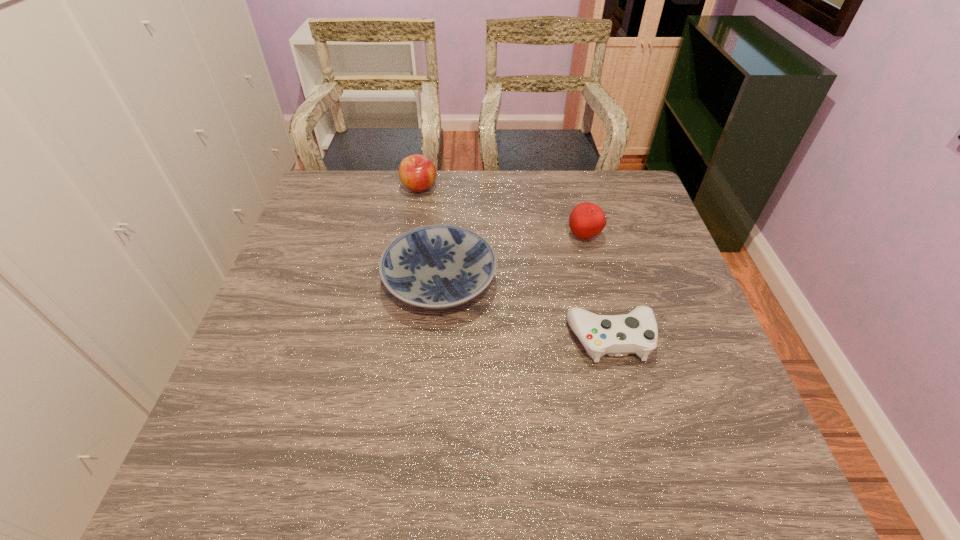
This screenshot has width=960, height=540. Identify the location of object present at the right edge. (636, 332).

In the image, there is a desktop. Identify the location of vacant space at the far edge. (387, 214).

This screenshot has height=540, width=960. In order to click on free region at the near edge in this screenshot , I will do `click(594, 471)`.

Locate an element on the screen. free spot at the left edge of the desktop is located at coordinates (350, 222).

Locate an element on the screen. The width and height of the screenshot is (960, 540). free space at the right edge of the desktop is located at coordinates (691, 384).

Image resolution: width=960 pixels, height=540 pixels. In order to click on vacant position at the far left corner of the desktop in this screenshot , I will do `click(349, 191)`.

This screenshot has width=960, height=540. Identify the location of vacant area at the near left corner of the desktop. (228, 465).

You are a GUI agent. You are given a task and a screenshot of the screen. Output one action in this format:
    pyautogui.click(x=<x>, y=<y>)
    Task: Click on the vacant region at the near right corner
    This screenshot has width=960, height=540.
    Given the screenshot: What is the action you would take?
    pyautogui.click(x=751, y=477)

Image resolution: width=960 pixels, height=540 pixels. Find the location of `unoccupied area between the control and the left apple`. unoccupied area between the control and the left apple is located at coordinates (515, 263).

Find the location of a particular element. vacant space in between the left apple and the control is located at coordinates coord(515,263).